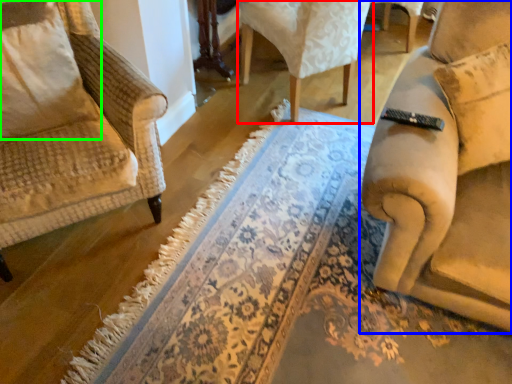
Question: Which is nearer to the chair (highlighted by a red box)? chair (highlighted by a blue box) or pillow (highlighted by a green box).

Choices:
 (A) chair
 (B) pillow

Answer: (A)